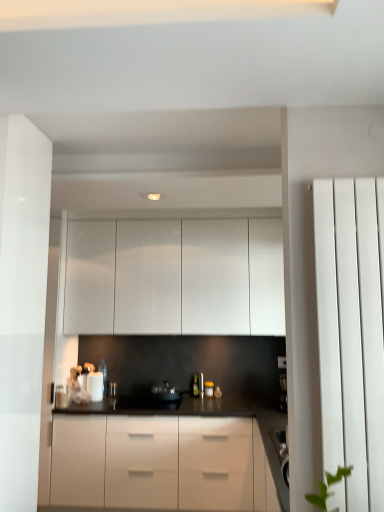
Question: From their relative heights in the image, would you say matte silver faucet at center is taller or shorter than black matte countertop at center?

Choices:
 (A) short
 (B) tall

Answer: (A)

Question: Considering the positions of matte silver faucet at center and black matte countertop at center in the image, is matte silver faucet at center bigger or smaller than black matte countertop at center?

Choices:
 (A) big
 (B) small

Answer: (B)

Question: Considering the real-world distances, which object is closest to the white smooth radiator at right?

Choices:
 (A) black glossy kettle at center
 (B) matte silver faucet at center
 (C) black matte countertop at center
 (D) black plastic coffee machine at right
 (E) white glossy cabinets at upper center

Answer: (C)

Question: Based on their relative distances, which object is farther from the black matte countertop at center?

Choices:
 (A) black plastic coffee machine at right
 (B) matte silver faucet at center
 (C) white glossy cabinets at upper center
 (D) white smooth radiator at right
 (E) black glossy kettle at center

Answer: (D)